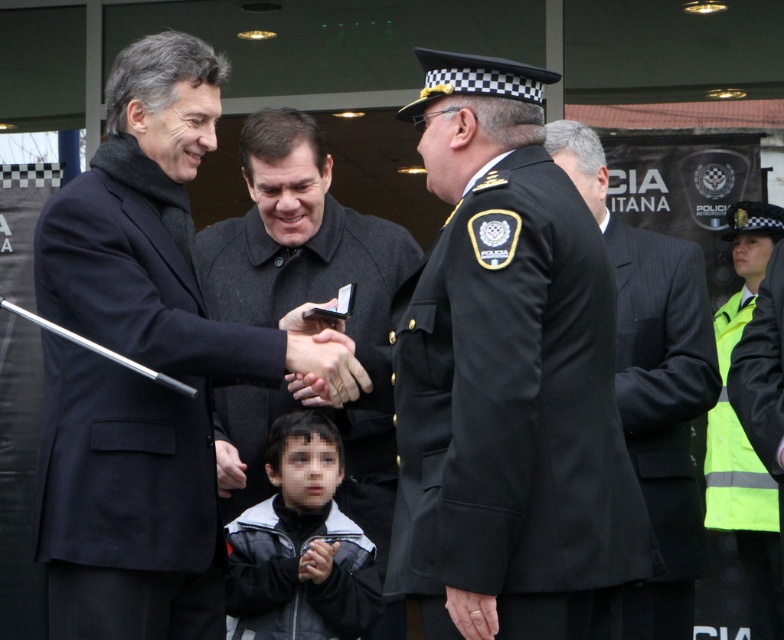
You are organizing a charity event and need to determine which coat to use for a display. Both the dark gray wool coat at center and the black fleece jacket at center are available. Based on their sizes, which one would be more suitable for a large mannequin that requires a bigger garment?

The dark gray wool coat at center is larger in size than the black fleece jacket at center, so it would be more suitable for the large mannequin requiring a bigger garment.

You are a photographer adjusting your camera to focus on two points in the scene. The first point is at coordinates point (202, 282) and the second is at point (249, 614). Which point should you focus on first if you want to capture the closest object in the image?

Point (202, 282) is closer to the viewer than point (249, 614), so you should focus on point (202, 282) first to capture the closest object.

You are a photographer at the event and need to ensure both the black uniform at center and the black fleece jacket at center are visible in the photo. Based on their positions, which one is closer to the camera?

The black uniform at center is in front of the black fleece jacket at center, so the black uniform at center is closer to the camera.